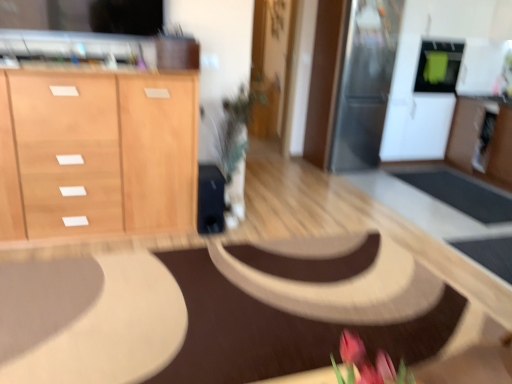
Question: Should I look upward or downward to see brown fabric mat at center?

Choices:
 (A) down
 (B) up

Answer: (A)

Question: Does sleek stainless steel refrigerator at upper right, which is the second appliance in right-to-left order, appear on the left side of light wood cabinet at left?

Choices:
 (A) yes
 (B) no

Answer: (B)

Question: Is sleek stainless steel refrigerator at upper right, the 1th appliance viewed from the left, far away from light wood cabinet at left?

Choices:
 (A) no
 (B) yes

Answer: (B)

Question: Does sleek stainless steel refrigerator at upper right, the 1th appliance viewed from the left, have a greater width compared to light wood cabinet at left?

Choices:
 (A) yes
 (B) no

Answer: (B)

Question: From a real-world perspective, does sleek stainless steel refrigerator at upper right, the 1th appliance viewed from the left, stand above light wood cabinet at left?

Choices:
 (A) yes
 (B) no

Answer: (A)

Question: Could you tell me if sleek stainless steel refrigerator at upper right, which is the second appliance in right-to-left order, is facing light wood cabinet at left?

Choices:
 (A) no
 (B) yes

Answer: (A)

Question: Is sleek stainless steel refrigerator at upper right, the 1th appliance viewed from the left, to the right of light wood cabinet at left from the viewer's perspective?

Choices:
 (A) yes
 (B) no

Answer: (A)

Question: Is green matte microwave at upper right, arranged as the 1th appliance when viewed from the right, oriented towards sleek stainless steel refrigerator at upper right, which is the second appliance in right-to-left order?

Choices:
 (A) no
 (B) yes

Answer: (A)

Question: Can sleek stainless steel refrigerator at upper right, the 1th appliance viewed from the left, be found inside green matte microwave at upper right, arranged as the 1th appliance when viewed from the right?

Choices:
 (A) yes
 (B) no

Answer: (B)

Question: Can you confirm if green matte microwave at upper right, arranged as the 1th appliance when viewed from the right, is thinner than sleek stainless steel refrigerator at upper right, which is the second appliance in right-to-left order?

Choices:
 (A) no
 (B) yes

Answer: (B)

Question: Does green matte microwave at upper right, the 2th appliance positioned from the left, lie behind sleek stainless steel refrigerator at upper right, which is the second appliance in right-to-left order?

Choices:
 (A) yes
 (B) no

Answer: (A)

Question: Is green matte microwave at upper right, the 2th appliance positioned from the left, smaller than sleek stainless steel refrigerator at upper right, the 1th appliance viewed from the left?

Choices:
 (A) yes
 (B) no

Answer: (A)

Question: Are green matte microwave at upper right, arranged as the 1th appliance when viewed from the right, and sleek stainless steel refrigerator at upper right, the 1th appliance viewed from the left, making contact?

Choices:
 (A) yes
 (B) no

Answer: (B)

Question: Is light wood cabinet at left looking in the opposite direction of green matte microwave at upper right, the 2th appliance positioned from the left?

Choices:
 (A) no
 (B) yes

Answer: (A)